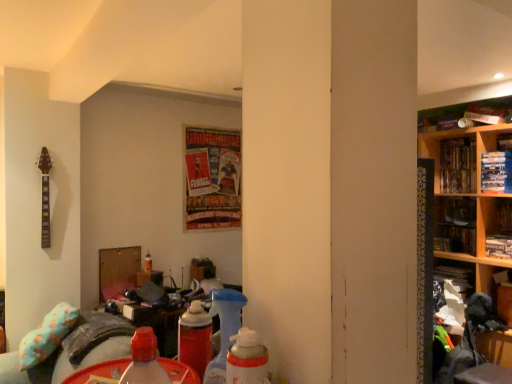
Identify the location of translucent plastic bottle at center, marked as the 1th bottle in a top-to-bottom arrangement. (144, 360).

What do you see at coordinates (148, 262) in the screenshot?
I see `translucent plastic bottle at center, which is the 2th bottle in top-to-bottom order` at bounding box center [148, 262].

The width and height of the screenshot is (512, 384). What do you see at coordinates (496, 172) in the screenshot?
I see `hardcover books at upper right, the 4th book from the left` at bounding box center [496, 172].

Identify the location of translucent plastic bottle at center, which ranks as the 2th bottle in left-to-right order. (144, 360).

In order to click on book that is the 2nd one when counting upward from the hardcover book at right, the first book when ordered from right to left (from the image's perspective) in this screenshot , I will do `click(212, 178)`.

Which object is further away from the camera, hardcover book at right, the first book when ordered from right to left, or shiny paper poster at center, which ranks as the fifth book in right-to-left order?

Positioned behind is shiny paper poster at center, which ranks as the fifth book in right-to-left order.

Which of these two, hardcover book at right, the first book when ordered from right to left, or shiny paper poster at center, which ranks as the fifth book in right-to-left order, is bigger?

shiny paper poster at center, which ranks as the fifth book in right-to-left order.

Is shiny plastic dvd case at upper right, which is counted as the second book, starting from the left, far from wooden shelves at right?

No, shiny plastic dvd case at upper right, which is counted as the second book, starting from the left, is not far away from wooden shelves at right.

From a real-world perspective, is shiny plastic dvd case at upper right, which is counted as the second book, starting from the left, located beneath wooden shelves at right?

No, from a real-world perspective, shiny plastic dvd case at upper right, which is counted as the second book, starting from the left, is not beneath wooden shelves at right.

Looking at their sizes, would you say shiny plastic dvd case at upper right, which is counted as the second book, starting from the left, is wider or thinner than wooden shelves at right?

shiny plastic dvd case at upper right, which is counted as the second book, starting from the left, is thinner than wooden shelves at right.

Is shiny plastic dvd case at upper right, acting as the 4th book starting from the right, in front of or behind wooden shelves at right in the image?

Clearly, shiny plastic dvd case at upper right, acting as the 4th book starting from the right, is behind wooden shelves at right.

Considering the points (233, 153) and (492, 202), which point is behind, point (233, 153) or point (492, 202)?

The point (233, 153) is more distant.

Is shiny paper poster at center, positioned as the first book in left-to-right order, positioned with its back to wooden shelves at right?

No, shiny paper poster at center, positioned as the first book in left-to-right order, is not facing away from wooden shelves at right.

Considering the positions of objects shiny paper poster at center, positioned as the first book in left-to-right order, and wooden shelves at right in the image provided, who is behind, shiny paper poster at center, positioned as the first book in left-to-right order, or wooden shelves at right?

shiny paper poster at center, positioned as the first book in left-to-right order, is behind.

Is shiny paper poster at center, which ranks as the fifth book in right-to-left order, taller than wooden shelves at right?

In fact, shiny paper poster at center, which ranks as the fifth book in right-to-left order, may be shorter than wooden shelves at right.

Can you confirm if hardcover books at upper right, arranged as the 2th book when viewed from the right, is shorter than shiny paper poster at center, which ranks as the fifth book in right-to-left order?

Indeed, hardcover books at upper right, arranged as the 2th book when viewed from the right, has a lesser height compared to shiny paper poster at center, which ranks as the fifth book in right-to-left order.

From a real-world perspective, who is located higher, hardcover books at upper right, arranged as the 2th book when viewed from the right, or shiny paper poster at center, positioned as the first book in left-to-right order?

hardcover books at upper right, arranged as the 2th book when viewed from the right, is physically above.

Between hardcover books at upper right, arranged as the 2th book when viewed from the right, and shiny paper poster at center, which ranks as the fifth book in right-to-left order, which one has larger size?

With larger size is shiny paper poster at center, which ranks as the fifth book in right-to-left order.

From a real-world perspective, which book is the 1st one above the shiny paper poster at center, positioned as the first book in left-to-right order? Please provide its 2D coordinates.

[(496, 172)]

Based on the photo, is shiny plastic dvd case at upper right, acting as the 4th book starting from the right, shorter than translucent plastic bottle at center, marked as the second bottle in a back-to-front arrangement?

In fact, shiny plastic dvd case at upper right, acting as the 4th book starting from the right, may be taller than translucent plastic bottle at center, marked as the second bottle in a back-to-front arrangement.

Find the location of a particular element. book that is the 4th one when counting upward from the translucent plastic bottle at center, which ranks as the 2th bottle in left-to-right order (from the image's perspective) is located at coordinates (457, 165).

Considering the relative sizes of shiny plastic dvd case at upper right, which is counted as the second book, starting from the left, and translucent plastic bottle at center, which is the first bottle from front to back, in the image provided, is shiny plastic dvd case at upper right, which is counted as the second book, starting from the left, bigger than translucent plastic bottle at center, which is the first bottle from front to back,?

Yes.

Which is more to the left, shiny plastic dvd case at upper right, acting as the 4th book starting from the right, or hardcover books at upper right, the 4th book from the left?

Positioned to the left is shiny plastic dvd case at upper right, acting as the 4th book starting from the right.

Which point is more distant from viewer, (445, 189) or (488, 155)?

Positioned behind is point (445, 189).

Is shiny plastic dvd case at upper right, acting as the 4th book starting from the right, facing towards hardcover books at upper right, arranged as the 2th book when viewed from the right?

No, shiny plastic dvd case at upper right, acting as the 4th book starting from the right, is not turned towards hardcover books at upper right, arranged as the 2th book when viewed from the right.

Is shiny plastic dvd case at upper right, which is counted as the second book, starting from the left, not close to hardcover books at upper right, arranged as the 2th book when viewed from the right?

No, shiny plastic dvd case at upper right, which is counted as the second book, starting from the left, is in close proximity to hardcover books at upper right, arranged as the 2th book when viewed from the right.

Which object is thinner, hardcover books at upper right, the 4th book from the left, or translucent plastic bottle at center, marked as the 1th bottle in a top-to-bottom arrangement?

translucent plastic bottle at center, marked as the 1th bottle in a top-to-bottom arrangement, is thinner.

Consider the image. Could you tell me if hardcover books at upper right, arranged as the 2th book when viewed from the right, is turned towards translucent plastic bottle at center, marked as the second bottle in a back-to-front arrangement?

No.

Is hardcover books at upper right, arranged as the 2th book when viewed from the right, bigger than translucent plastic bottle at center, which ranks as the 2th bottle in left-to-right order?

Yes.

Would you say hardcover books at upper right, the 4th book from the left, is a long distance from translucent plastic bottle at center, marked as the 1th bottle in a top-to-bottom arrangement?

Yes.

Locate an element on the screen. This screenshot has height=384, width=512. the 4th book to the right of the shiny paper poster at center, positioned as the first book in left-to-right order, starting your count from the anchor is located at coordinates (498, 246).

I want to click on book that is the 5th one when counting upward from the wooden shelves at right (from the image's perspective), so click(x=457, y=165).

When comparing their distances from fluffy teal pillow at lower left, does hardcover book at right, the fifth book viewed from the left, or shiny plastic dvd case at upper right, acting as the 4th book starting from the right, seem closer?

hardcover book at right, the fifth book viewed from the left, is closer to fluffy teal pillow at lower left.

Looking at the image, which one is located further to translucent plastic bottle at center, the 1th bottle viewed from the right, shiny plastic dvd case at upper right, which is counted as the second book, starting from the left, or shiny paper poster at center, which ranks as the fifth book in right-to-left order?

shiny plastic dvd case at upper right, which is counted as the second book, starting from the left, lies further to translucent plastic bottle at center, the 1th bottle viewed from the right, than the other object.

Which object lies further to the anchor point shiny paper poster at center, which ranks as the fifth book in right-to-left order, translucent plastic bottle at center, positioned as the 2th bottle in bottom-to-top order, or hardcover book at upper right, marked as the 3th book in a left-to-right arrangement?

translucent plastic bottle at center, positioned as the 2th bottle in bottom-to-top order.

Estimate the real-world distances between objects in this image. Which object is further from translucent plastic bottle at center, which is the 2th bottle in top-to-bottom order, shiny plastic dvd case at upper right, acting as the 4th book starting from the right, or wooden shelves at right?

shiny plastic dvd case at upper right, acting as the 4th book starting from the right.

When comparing their distances from hardcover books at upper right, the 4th book from the left, does fluffy teal pillow at lower left or wooden shelves at right seem closer?

wooden shelves at right lies closer to hardcover books at upper right, the 4th book from the left, than the other object.

Estimate the real-world distances between objects in this image. Which object is further from translucent plastic bottle at center, which is the 2th bottle in top-to-bottom order, translucent plastic bottle at center, the 1th bottle viewed from the right, or wooden shelves at right?

translucent plastic bottle at center, the 1th bottle viewed from the right, is positioned further to the anchor translucent plastic bottle at center, which is the 2th bottle in top-to-bottom order.

Considering their positions, is translucent plastic bottle at center, which ranks as the 2th bottle in left-to-right order, positioned closer to fluffy teal pillow at lower left than hardcover books at upper right, arranged as the 2th book when viewed from the right?

translucent plastic bottle at center, which ranks as the 2th bottle in left-to-right order, is closer to fluffy teal pillow at lower left.

Looking at the image, which one is located further to shiny paper poster at center, which ranks as the fifth book in right-to-left order, hardcover book at right, the fifth book viewed from the left, or shiny plastic dvd case at upper right, acting as the 4th book starting from the right?

Based on the image, hardcover book at right, the fifth book viewed from the left, appears to be further to shiny paper poster at center, which ranks as the fifth book in right-to-left order.

The height and width of the screenshot is (384, 512). What are the coordinates of `shelf between translucent plastic bottle at center, which is counted as the 1th bottle, starting from the bottom, and hardcover book at right, the first book when ordered from right to left, from left to right` in the screenshot? It's located at (467, 192).

Identify the location of shelf between fluffy teal pillow at lower left and shiny plastic dvd case at upper right, which is counted as the second book, starting from the left, in the horizontal direction. (467, 192).

Where is `shelf between translucent plastic bottle at center, positioned as the 2th bottle in bottom-to-top order, and shiny paper poster at center, which ranks as the fifth book in right-to-left order, along the z-axis`? shelf between translucent plastic bottle at center, positioned as the 2th bottle in bottom-to-top order, and shiny paper poster at center, which ranks as the fifth book in right-to-left order, along the z-axis is located at coordinates (467, 192).

Identify the location of bottle positioned between translucent plastic bottle at center, which is the first bottle from front to back, and shiny paper poster at center, which ranks as the fifth book in right-to-left order, from near to far. (148, 262).